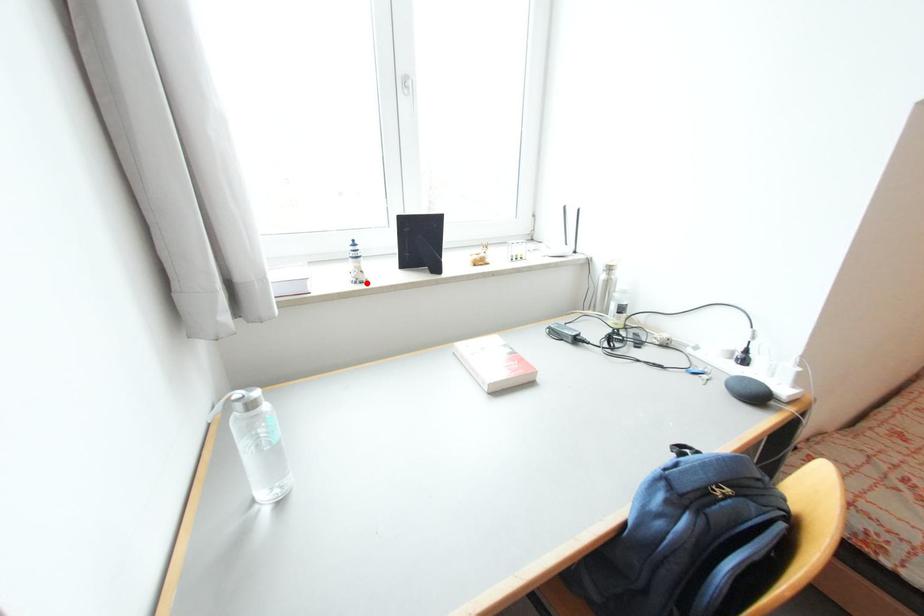
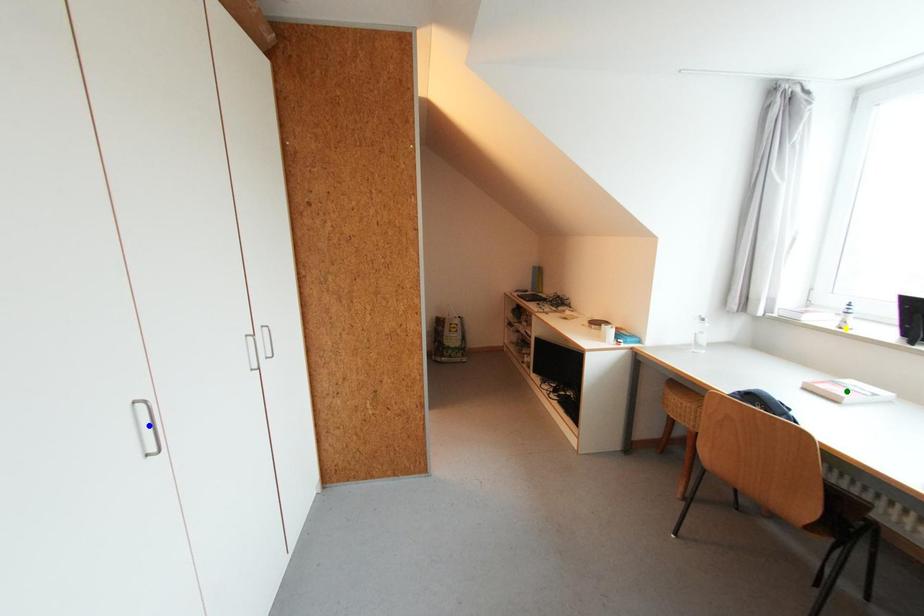
Question: I am providing you with two images of the same scene from different viewpoints. A red point is marked on the first image. You are given multiple points on the second image. In image 2, which mark is for the same physical point as the one in image 1?

Choices:
 (A) green point
 (B) yellow point
 (C) blue point

Answer: (B)